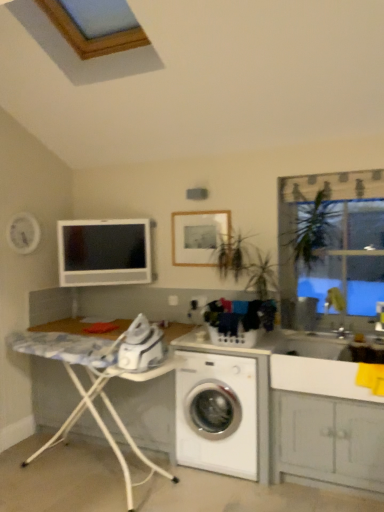
At what (x,y) coordinates should I click in order to perform the action: click on white glossy sink at lower right, positioned as the 2th sink in top-to-bottom order. Please return your answer as a coordinate pair (x, y). The image size is (384, 512). Looking at the image, I should click on (316, 367).

What do you see at coordinates (331, 243) in the screenshot? The height and width of the screenshot is (512, 384). I see `clear glass window at upper right` at bounding box center [331, 243].

The image size is (384, 512). Find the location of `white glossy sink at center, acting as the first sink starting from the top`. white glossy sink at center, acting as the first sink starting from the top is located at coordinates tap(336, 308).

Where is `matte wooden picture frame at upper center`? This screenshot has width=384, height=512. matte wooden picture frame at upper center is located at coordinates (198, 236).

Measure the distance between point (202, 260) and camera.

They are 11.76 feet apart.

At what (x,y) coordinates should I click in order to perform the action: click on white glossy sink at lower right, acting as the 1th sink starting from the bottom. Please return your answer as a coordinate pair (x, y). The image size is (384, 512). Looking at the image, I should click on (316, 367).

From the image's perspective, between clear glass window at upper right and white painted wood cabinet at lower right, who is located below?

From the image's view, white painted wood cabinet at lower right is below.

Which object is thinner, clear glass window at upper right or white painted wood cabinet at lower right?

clear glass window at upper right.

Would you say clear glass window at upper right is to the left or to the right of white painted wood cabinet at lower right in the picture?

Clearly, clear glass window at upper right is on the right of white painted wood cabinet at lower right in the image.

Consider the image. How different are the orientations of clear glass window at upper right and white painted wood cabinet at lower right in degrees?

The angle between the facing direction of clear glass window at upper right and the facing direction of white painted wood cabinet at lower right is 0.313 degrees.

From the image's perspective, is white glossy sink at center, acting as the first sink starting from the top, located beneath matte white computer monitor at upper left?

Correct, white glossy sink at center, acting as the first sink starting from the top, appears lower than matte white computer monitor at upper left in the image.

How distant is white glossy sink at center, the second sink from the bottom, from matte white computer monitor at upper left?

A distance of 1.82 meters exists between white glossy sink at center, the second sink from the bottom, and matte white computer monitor at upper left.

How different are the orientations of white glossy sink at center, the second sink from the bottom, and matte white computer monitor at upper left in degrees?

white glossy sink at center, the second sink from the bottom, and matte white computer monitor at upper left are facing 52 degrees away from each other.

From a real-world perspective, starting from the matte white computer monitor at upper left, which sink is the 1st one below it? Please provide its 2D coordinates.

[(336, 308)]

From a real-world perspective, which object rests below the other?

From a 3D spatial view, white painted wood cabinet at lower right is below.

Between white glossy sink at center, acting as the first sink starting from the top, and white painted wood cabinet at lower right, which one appears on the left side from the viewer's perspective?

From the viewer's perspective, white painted wood cabinet at lower right appears more on the left side.

Consider the image. Is white glossy sink at center, acting as the first sink starting from the top, shorter than white painted wood cabinet at lower right?

Yes.

Is white marble ironing board at lower left taller or shorter than white glossy sink at center, the second sink from the bottom?

white marble ironing board at lower left is taller than white glossy sink at center, the second sink from the bottom.

Does white marble ironing board at lower left come behind white glossy sink at center, the second sink from the bottom?

No, white marble ironing board at lower left is in front of white glossy sink at center, the second sink from the bottom.

Is white marble ironing board at lower left positioned with its back to white glossy sink at center, acting as the first sink starting from the top?

No.

Does white marble ironing board at lower left appear on the left side of white glossy sink at center, acting as the first sink starting from the top?

Yes.

From a real-world perspective, is white painted wood cabinet at lower right on top of white plastic washing machine at lower center?

Answer: Yes, from a real-world perspective, white painted wood cabinet at lower right is over white plastic washing machine at lower center

Considering the sizes of white painted wood cabinet at lower right and white plastic washing machine at lower center in the image, is white painted wood cabinet at lower right bigger or smaller than white plastic washing machine at lower center?

white painted wood cabinet at lower right is bigger than white plastic washing machine at lower center.

Considering the positions of point (321, 417) and point (182, 416), is point (321, 417) closer or farther from the camera than point (182, 416)?

Clearly, point (321, 417) is closer to the camera than point (182, 416).

Does white glossy sink at lower right, positioned as the 2th sink in top-to-bottom order, have a lesser width compared to matte white computer monitor at upper left?

In fact, white glossy sink at lower right, positioned as the 2th sink in top-to-bottom order, might be wider than matte white computer monitor at upper left.

Is white glossy sink at lower right, acting as the 1th sink starting from the bottom, positioned in front of matte white computer monitor at upper left?

Yes, white glossy sink at lower right, acting as the 1th sink starting from the bottom, is closer to the viewer.

Looking at this image, is white glossy sink at lower right, positioned as the 2th sink in top-to-bottom order, not within matte white computer monitor at upper left?

Yes, white glossy sink at lower right, positioned as the 2th sink in top-to-bottom order, is not within matte white computer monitor at upper left.

This screenshot has height=512, width=384. Identify the location of the 1st sink counting from the right of the matte white computer monitor at upper left. (316, 367).

Would you say matte white computer monitor at upper left is outside white plastic washing machine at lower center?

Indeed, matte white computer monitor at upper left is completely outside white plastic washing machine at lower center.

Looking at this image, is matte white computer monitor at upper left positioned far away from white plastic washing machine at lower center?

Absolutely, matte white computer monitor at upper left is distant from white plastic washing machine at lower center.

Does matte white computer monitor at upper left have a lesser width compared to white plastic washing machine at lower center?

Correct, the width of matte white computer monitor at upper left is less than that of white plastic washing machine at lower center.

Find the location of a particular element. Image resolution: width=384 pixels, height=512 pixels. cabinetry below the clear glass window at upper right (from a real-world perspective) is located at coordinates click(327, 440).

Where is `the 1st sink in front of the matte white computer monitor at upper left`? the 1st sink in front of the matte white computer monitor at upper left is located at coordinates (336, 308).

From the image, which object appears to be nearer to matte wooden picture frame at upper center, matte white computer monitor at upper left or white plastic washing machine at lower center?

matte white computer monitor at upper left is closer to matte wooden picture frame at upper center.

Which object lies nearer to the anchor point white painted wood cabinet at lower right, white marble ironing board at lower left or clear glass window at upper right?

clear glass window at upper right is positioned closer to the anchor white painted wood cabinet at lower right.

Based on their spatial positions, is white glossy sink at center, the second sink from the bottom, or white plastic washing machine at lower center closer to matte white computer monitor at upper left?

Based on the image, white plastic washing machine at lower center appears to be nearer to matte white computer monitor at upper left.

Looking at the image, which one is located closer to clear glass window at upper right, matte white computer monitor at upper left or matte wooden picture frame at upper center?

Among the two, matte wooden picture frame at upper center is located nearer to clear glass window at upper right.

Estimate the real-world distances between objects in this image. Which object is closer to white plastic washing machine at lower center, matte white computer monitor at upper left or white marble ironing board at lower left?

white marble ironing board at lower left lies closer to white plastic washing machine at lower center than the other object.

In the scene shown: Looking at the image, which one is located closer to white glossy sink at lower right, acting as the 1th sink starting from the bottom, clear glass window at upper right or matte white computer monitor at upper left?

Based on the image, clear glass window at upper right appears to be nearer to white glossy sink at lower right, acting as the 1th sink starting from the bottom.

Based on their spatial positions, is white glossy sink at lower right, acting as the 1th sink starting from the bottom, or white marble ironing board at lower left closer to white plastic washing machine at lower center?

white marble ironing board at lower left is positioned closer to the anchor white plastic washing machine at lower center.

From the image, which object appears to be nearer to white glossy sink at lower right, acting as the 1th sink starting from the bottom, white painted wood cabinet at lower right or white plastic washing machine at lower center?

white painted wood cabinet at lower right is closer to white glossy sink at lower right, acting as the 1th sink starting from the bottom.

Locate an element on the screen. window frame between matte wooden picture frame at upper center and white painted wood cabinet at lower right from top to bottom is located at coordinates (331, 243).

At what (x,y) coordinates should I click in order to perform the action: click on picture frame located between white marble ironing board at lower left and white glossy sink at lower right, positioned as the 2th sink in top-to-bottom order, in the left-right direction. Please return your answer as a coordinate pair (x, y). The height and width of the screenshot is (512, 384). Looking at the image, I should click on (198, 236).

Find the location of `washing machine between white marble ironing board at lower left and clear glass window at upper right`. washing machine between white marble ironing board at lower left and clear glass window at upper right is located at coordinates (217, 414).

Where is `computer monitor between white marble ironing board at lower left and white glossy sink at lower right, acting as the 1th sink starting from the bottom, in the horizontal direction`? This screenshot has width=384, height=512. computer monitor between white marble ironing board at lower left and white glossy sink at lower right, acting as the 1th sink starting from the bottom, in the horizontal direction is located at coordinates (104, 252).